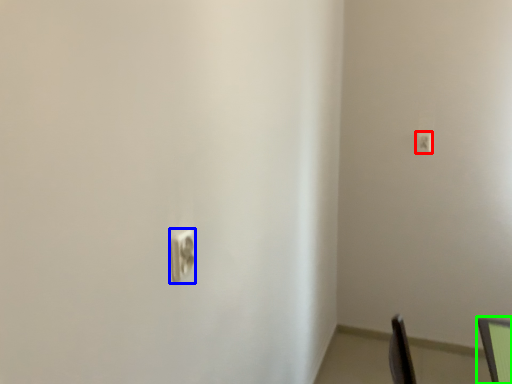
Question: Which is nearer to the light switch (highlighted by a red box)? light switch (highlighted by a blue box) or computer monitor (highlighted by a green box).

Choices:
 (A) light switch
 (B) computer monitor

Answer: (B)